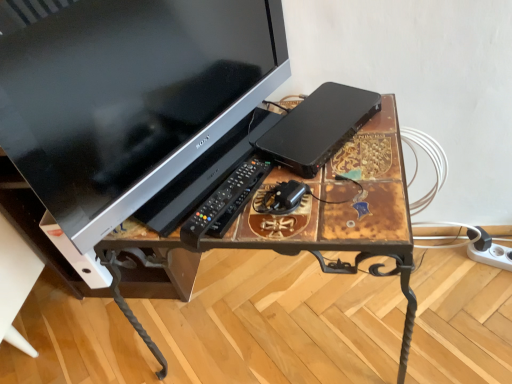
The height and width of the screenshot is (384, 512). I want to click on free point to the right of black plastic remote at center, so click(x=311, y=194).